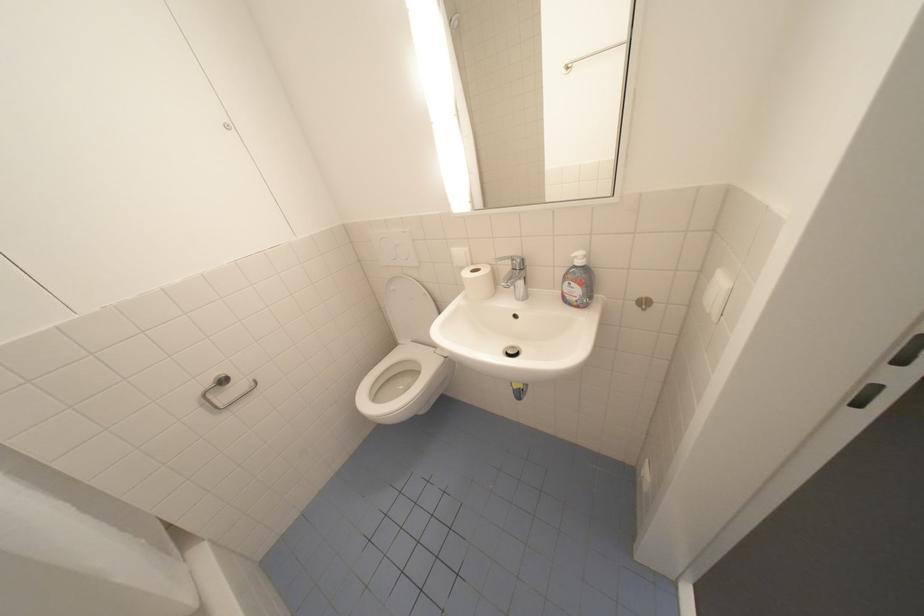
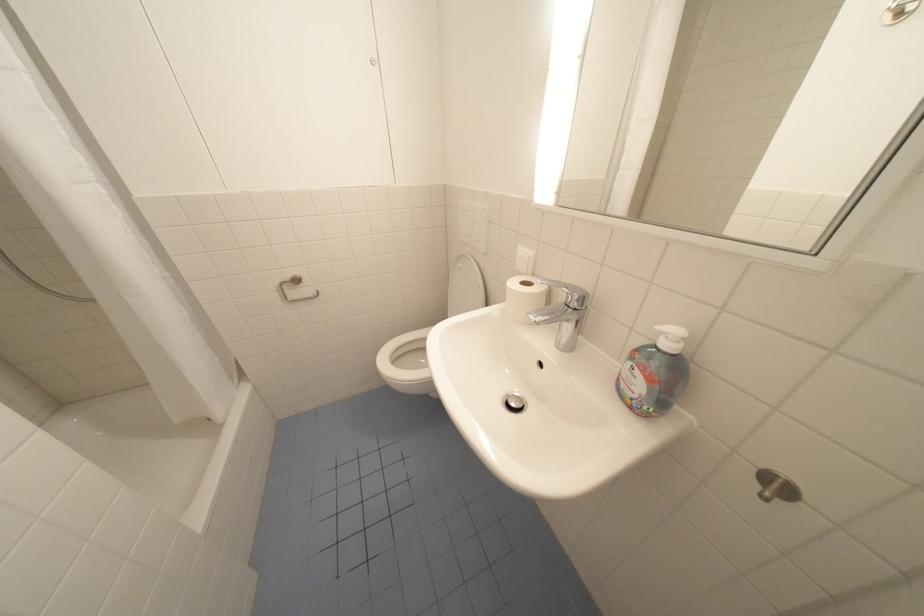
Find the pixel in the second image that matches pixel 642 304 in the first image.

(763, 471)